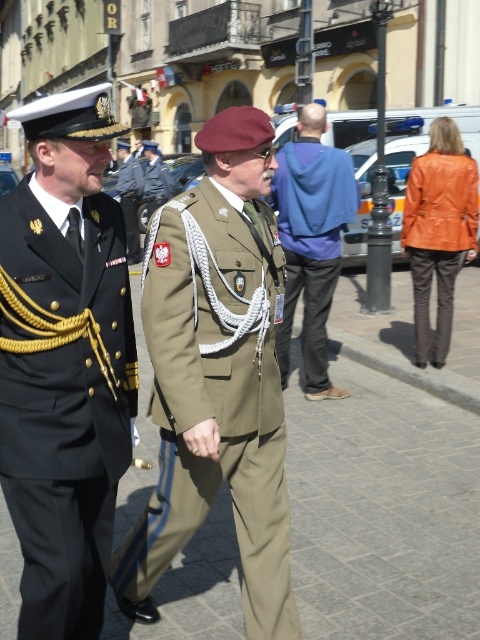
Question: Which point is farther from the camera taking this photo?

Choices:
 (A) (155, 244)
 (B) (142, 145)

Answer: (B)

Question: Does olive green fabric uniform at center have a smaller size compared to khaki fabric uniform at center?

Choices:
 (A) yes
 (B) no

Answer: (B)

Question: Which object appears farthest from the camera in this image?

Choices:
 (A) olive green fabric uniform at center
 (B) khaki fabric beret at center

Answer: (B)

Question: Which is nearer to the khaki fabric uniform at center?

Choices:
 (A) black satin military uniform at left
 (B) blue fleece at center
 (C) khaki fabric beret at center

Answer: (C)

Question: Is black satin military uniform at left wider than khaki fabric uniform at center?

Choices:
 (A) yes
 (B) no

Answer: (A)

Question: Can you confirm if black satin military uniform at left is positioned below khaki fabric uniform at center?

Choices:
 (A) no
 (B) yes

Answer: (B)